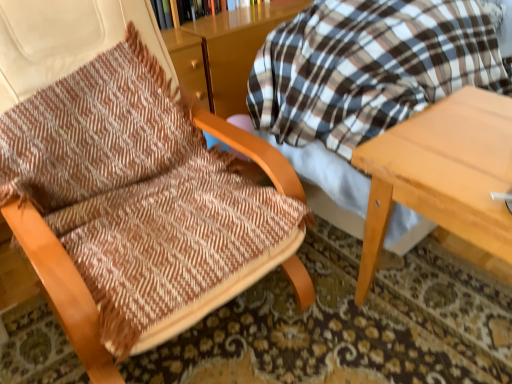
Question: Can you confirm if wooden bookcase at upper center is positioned to the right of light wood table at right?

Choices:
 (A) yes
 (B) no

Answer: (B)

Question: From a real-world perspective, is wooden bookcase at upper center positioned over light wood table at right based on gravity?

Choices:
 (A) yes
 (B) no

Answer: (A)

Question: Is there a large distance between wooden bookcase at upper center and light wood table at right?

Choices:
 (A) yes
 (B) no

Answer: (A)

Question: Is the depth of wooden bookcase at upper center less than that of light wood table at right?

Choices:
 (A) yes
 (B) no

Answer: (B)

Question: Can you confirm if wooden bookcase at upper center is taller than light wood table at right?

Choices:
 (A) no
 (B) yes

Answer: (A)

Question: Do you think light wood table at right is within wooden bookcase at upper center, or outside of it?

Choices:
 (A) outside
 (B) inside

Answer: (A)

Question: Relative to wooden bookcase at upper center, is light wood table at right in front or behind?

Choices:
 (A) behind
 (B) front

Answer: (B)

Question: Looking at the image, does light wood table at right seem bigger or smaller compared to wooden bookcase at upper center?

Choices:
 (A) big
 (B) small

Answer: (A)

Question: Considering the positions of point (418, 172) and point (161, 16), is point (418, 172) closer or farther from the camera than point (161, 16)?

Choices:
 (A) farther
 (B) closer

Answer: (B)

Question: Relative to light wood table at right, is wooden bookcase at upper center in front or behind?

Choices:
 (A) behind
 (B) front

Answer: (A)

Question: Is wooden bookcase at upper center spatially inside light wood table at right, or outside of it?

Choices:
 (A) inside
 (B) outside

Answer: (B)

Question: In the image, is wooden bookcase at upper center on the left side or the right side of light wood table at right?

Choices:
 (A) right
 (B) left

Answer: (B)

Question: Is point (182, 3) closer or farther from the camera than point (445, 170)?

Choices:
 (A) farther
 (B) closer

Answer: (A)

Question: In the image, is brown woven fabric chair at left on the left side or the right side of wooden bookcase at upper center?

Choices:
 (A) left
 (B) right

Answer: (A)

Question: Looking at their shapes, would you say brown woven fabric chair at left is wider or thinner than wooden bookcase at upper center?

Choices:
 (A) thin
 (B) wide

Answer: (B)